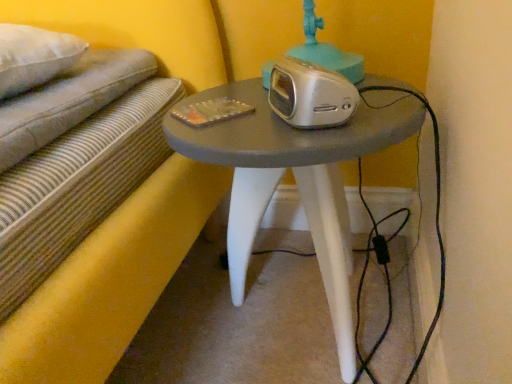
Locate an element on the screen. This screenshot has width=512, height=384. spots to the right of silver metallic alarm clock at center is located at coordinates (384, 99).